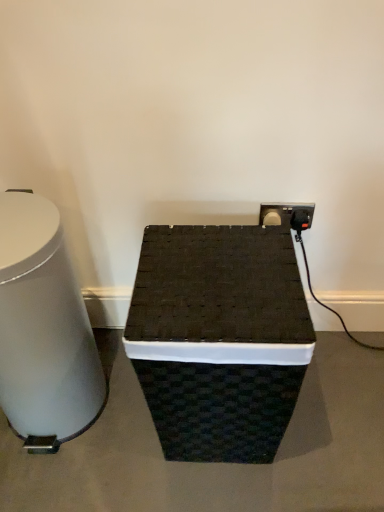
Image resolution: width=384 pixels, height=512 pixels. What are the coordinates of `vacant area on top of black woven basket at center (from a real-world perspective)` in the screenshot? It's located at (213, 271).